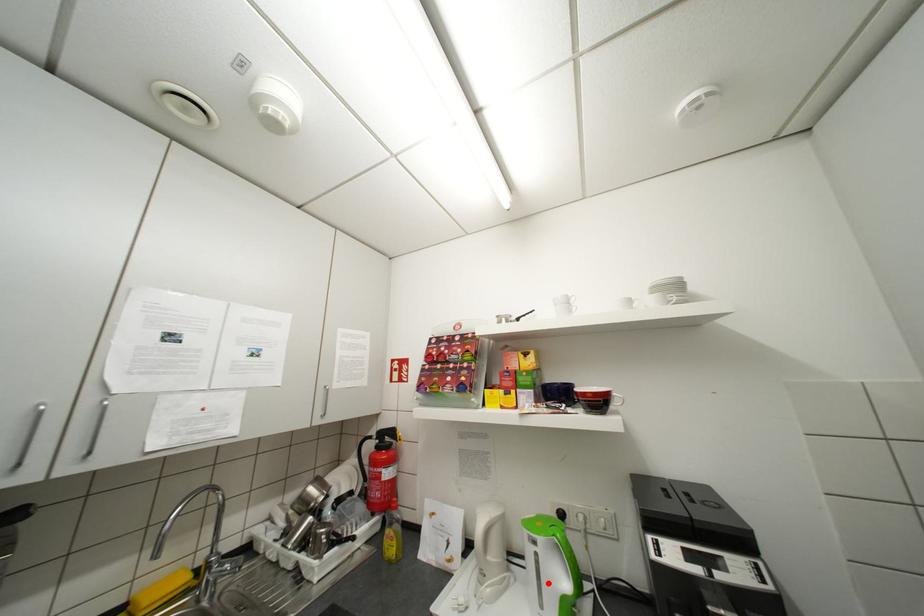
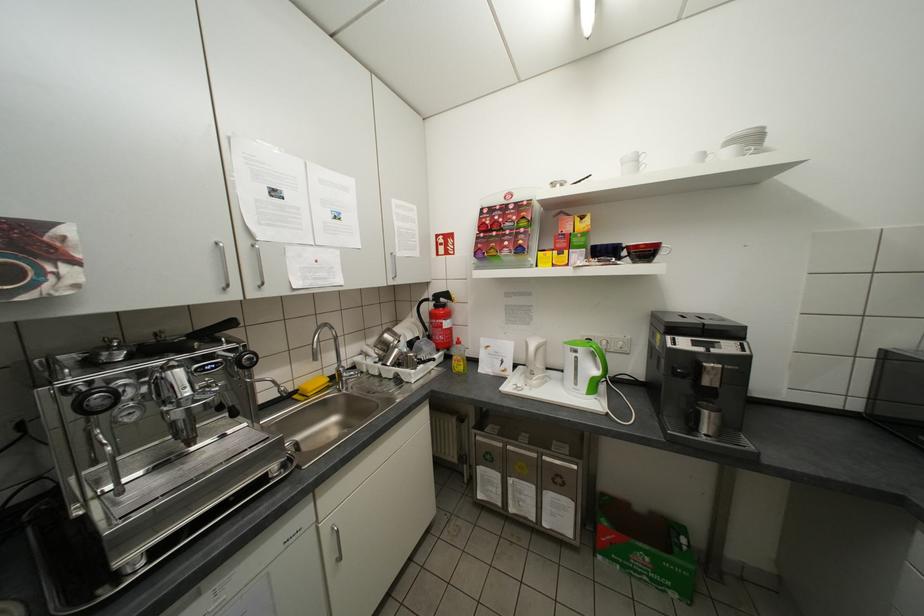
Question: I am providing you with two images of the same scene from different viewpoints. Given a red point in image1, look at the same physical point in image2. Is it:

Choices:
 (A) Closer to the viewpoint
 (B) Farther from the viewpoint

Answer: (A)